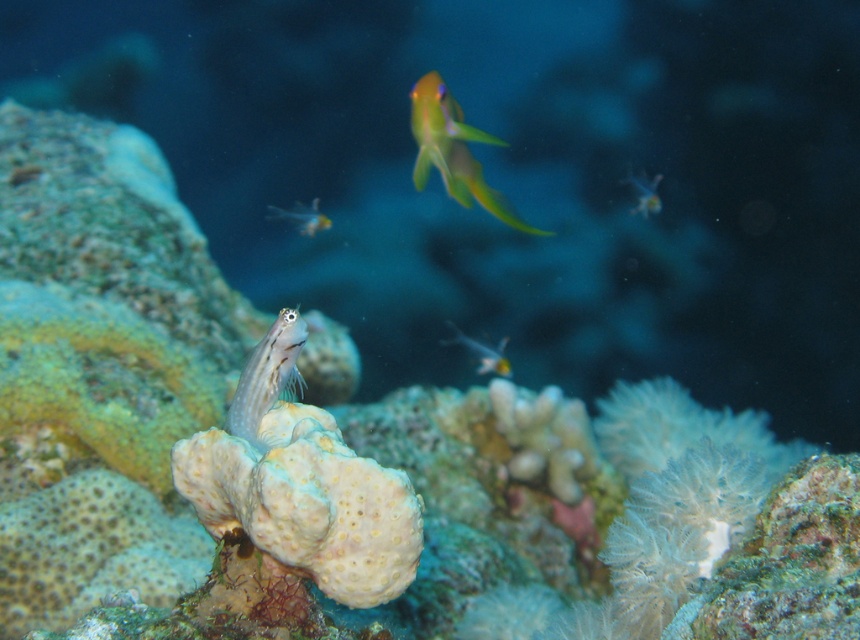
From the picture: You are a marine biologist studying the coral reef. You notice a point marked at coordinates (268, 378). What marine creature is located at that point?

The translucent blue fish at center is located at point (268, 378).